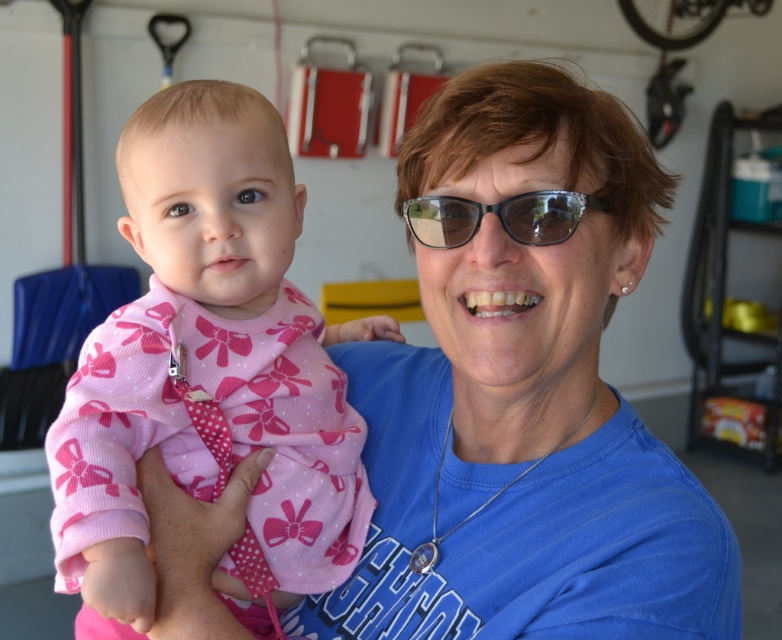
Is point (350, 480) more distant than point (472, 227)?

That is True.

Can you confirm if pink fabric baby at center is positioned to the left of transparent plastic glasses at center?

Correct, you'll find pink fabric baby at center to the left of transparent plastic glasses at center.

Between point (83, 600) and point (522, 218), which one is positioned in front?

Positioned in front is point (522, 218).

You are a GUI agent. You are given a task and a screenshot of the screen. Output one action in this format:
    pyautogui.click(x=<x>, y=<y>)
    Task: Click on the pink fabric baby at center
    
    Given the screenshot: What is the action you would take?
    pyautogui.click(x=210, y=368)